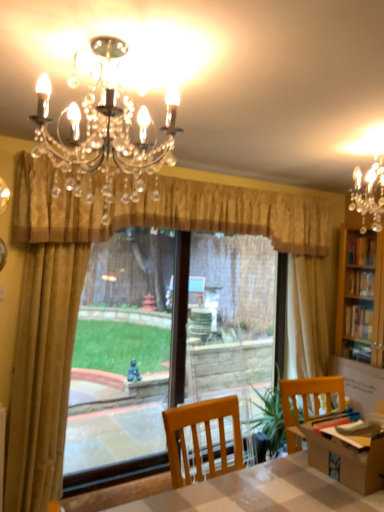
Question: From the image's perspective, is gold textured valance at center, the 2th curtain when ordered from left to right, positioned above or below translucent plastic screen door at center?

Choices:
 (A) below
 (B) above

Answer: (B)

Question: Considering the positions of gold textured valance at center, which is counted as the 1th curtain, starting from the right, and translucent plastic screen door at center in the image, is gold textured valance at center, which is counted as the 1th curtain, starting from the right, taller or shorter than translucent plastic screen door at center?

Choices:
 (A) short
 (B) tall

Answer: (A)

Question: Which object is the farthest from the translucent plastic screen door at center?

Choices:
 (A) gold fabric curtain at left, placed as the second curtain when sorted from right to left
 (B) smooth white table at center
 (C) gold textured valance at center, which is counted as the 1th curtain, starting from the right
 (D) matte black chandelier at upper center

Answer: (D)

Question: Estimate the real-world distances between objects in this image. Which object is farther from the matte black chandelier at upper center?

Choices:
 (A) gold textured valance at center, which is counted as the 1th curtain, starting from the right
 (B) smooth white table at center
 (C) gold fabric curtain at left, the 1th curtain from the left
 (D) translucent plastic screen door at center

Answer: (D)